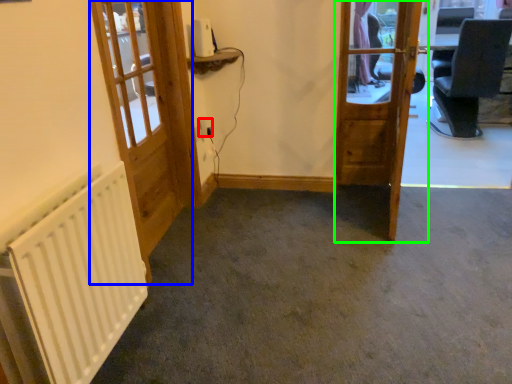
Question: Which object is the farthest from electric outlet (highlighted by a red box)? Choose among these: door (highlighted by a blue box) or door (highlighted by a green box).

Choices:
 (A) door
 (B) door

Answer: (B)